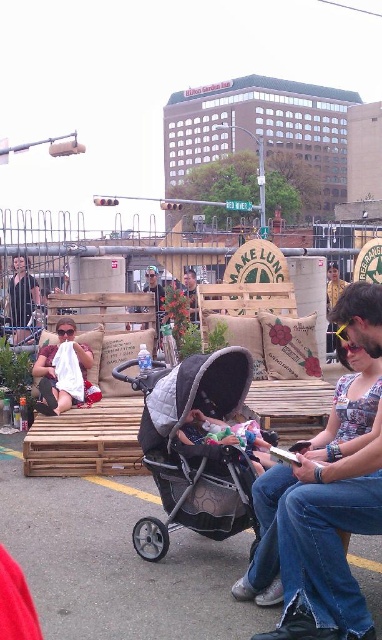
Identify the location of white cloth at center. (61, 371).

Looking at this image, is white cloth at center closer to camera compared to matte black t-shirt at left?

Yes, it is in front of matte black t-shirt at left.

This screenshot has height=640, width=382. What do you see at coordinates (61, 371) in the screenshot? I see `white cloth at center` at bounding box center [61, 371].

Identify the location of white cloth at center. (61, 371).

Between point (205, 500) and point (192, 410), which one is positioned in front?

Point (205, 500) is more forward.

Is black quilted fabric stroller at center shorter than soft pink fabric at center?

No.

Find the location of `black quilted fabric stroller at center`. black quilted fabric stroller at center is located at coordinates (192, 449).

Is soft pink fabric at center below matte black t-shirt at left?

Yes.

Is soft pink fabric at center further to the viewer compared to matte black t-shirt at left?

No, it is not.

The width and height of the screenshot is (382, 640). What do you see at coordinates (226, 436) in the screenshot?
I see `soft pink fabric at center` at bounding box center [226, 436].

Where is `soft pink fabric at center`? soft pink fabric at center is located at coordinates (226, 436).